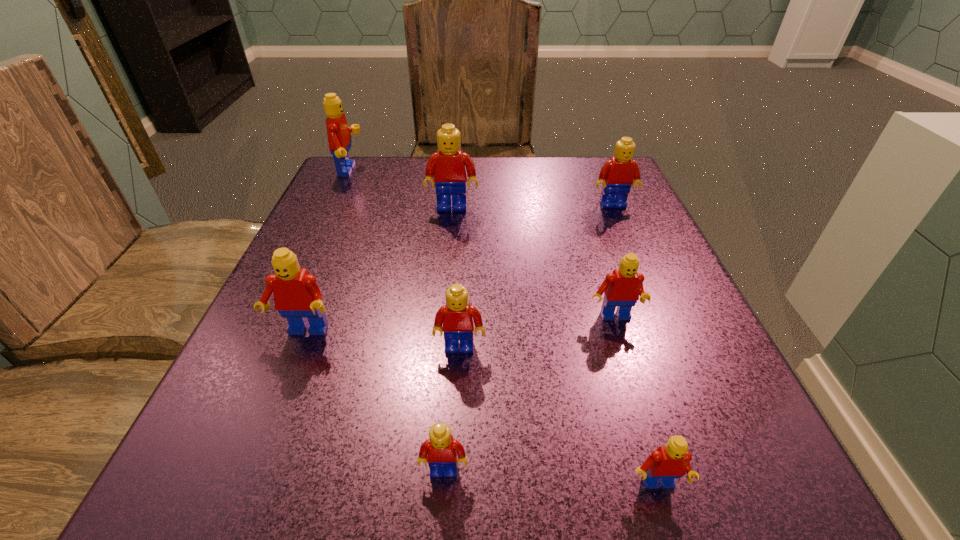
You are a GUI agent. You are given a task and a screenshot of the screen. Output one action in this format:
    pyautogui.click(x=<x>, y=<y>)
    Task: Click on the vacant region located 0.170m on the front-facing side of the biggest yellow Lego
    This screenshot has width=960, height=540.
    Given the screenshot: What is the action you would take?
    pyautogui.click(x=447, y=265)

Find the location of `vacant region located on the front-facing side of the rightmost yellow Lego`. vacant region located on the front-facing side of the rightmost yellow Lego is located at coordinates (624, 232).

The width and height of the screenshot is (960, 540). Find the location of `free space located on the front-facing side of the third smallest red Lego`. free space located on the front-facing side of the third smallest red Lego is located at coordinates (272, 410).

Find the location of a particular element. vacant point located on the front-facing side of the second smallest red Lego is located at coordinates (635, 388).

Locate an element on the screen. free space located 0.150m on the front-facing side of the third farthest yellow Lego is located at coordinates (455, 454).

At what (x,y) coordinates should I click in order to perform the action: click on object situated at the far left corner. Please return your answer as a coordinate pair (x, y). This screenshot has width=960, height=540. Looking at the image, I should click on (339, 138).

Identify the location of object situated at the far right corner. (618, 174).

This screenshot has width=960, height=540. Identify the location of object at the near right corner. (672, 461).

This screenshot has width=960, height=540. In order to click on free location at the far edge of the desktop in this screenshot , I will do `click(419, 181)`.

You are a GUI agent. You are given a task and a screenshot of the screen. Output one action in this format:
    pyautogui.click(x=<x>, y=<y>)
    Task: Click on the vacant space at the near edge of the desktop
    This screenshot has width=960, height=540.
    Given the screenshot: What is the action you would take?
    pyautogui.click(x=470, y=507)